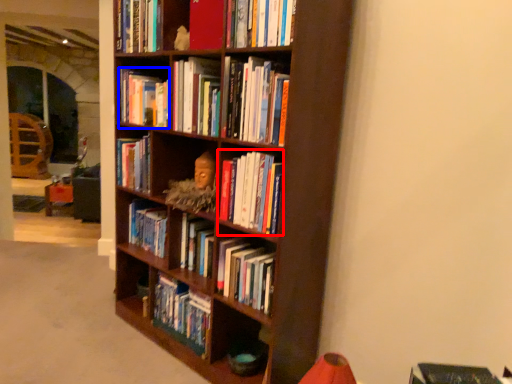
Question: Which of the following is the closest to the observer, book (highlighted by a red box) or book (highlighted by a blue box)?

Choices:
 (A) book
 (B) book

Answer: (A)